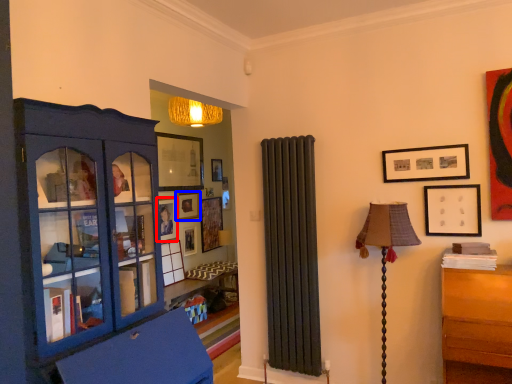
Question: Among these objects, which one is nearest to the camera, picture frame (highlighted by a red box) or picture frame (highlighted by a blue box)?

Choices:
 (A) picture frame
 (B) picture frame

Answer: (A)